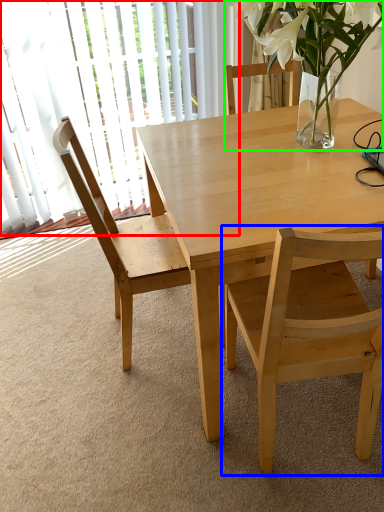
Question: Considering the real-world distances, which object is farthest from glass door (highlighted by a red box)? chair (highlighted by a blue box) or houseplant (highlighted by a green box)?

Choices:
 (A) chair
 (B) houseplant

Answer: (A)